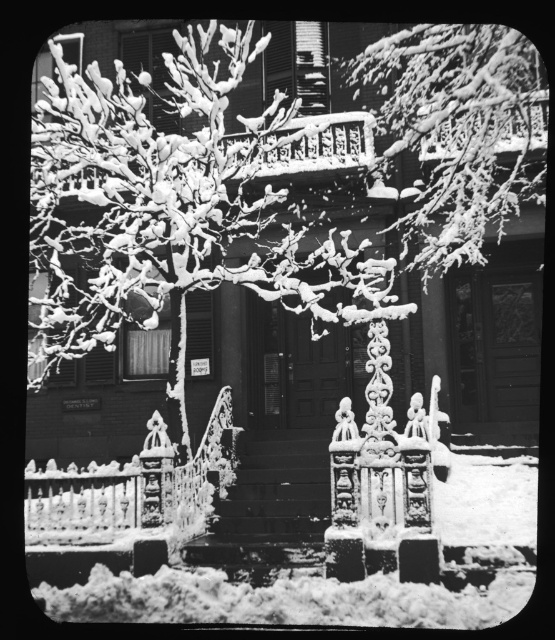
Which of these two, snow-covered branches at upper center or white fluffy snow at lower center, stands shorter?

white fluffy snow at lower center

Which is above, snow-covered branches at upper center or white fluffy snow at lower center?

snow-covered branches at upper center

In the scene shown: Who is more forward, (421, 125) or (282, 624)?

Point (282, 624) is in front.

The height and width of the screenshot is (640, 555). I want to click on snow-covered branches at upper center, so click(x=456, y=131).

Is point (77, 609) farther from viewer compared to point (124, 525)?

No, (77, 609) is closer to viewer.

This screenshot has height=640, width=555. I want to click on white fluffy snow at lower center, so click(x=284, y=600).

Between snow-covered branches at upper center and snow-covered wrought iron fence at center, which one has more height?

snow-covered branches at upper center

Which is more to the right, snow-covered branches at upper center or snow-covered wrought iron fence at center?

snow-covered branches at upper center is more to the right.

Does point (477, 248) lie in front of point (62, 513)?

That is False.

You are a GUI agent. You are given a task and a screenshot of the screen. Output one action in this format:
    pyautogui.click(x=<x>, y=<y>)
    Task: Click on the snow-covered branches at upper center
    This screenshot has width=555, height=640.
    Given the screenshot: What is the action you would take?
    (456, 131)